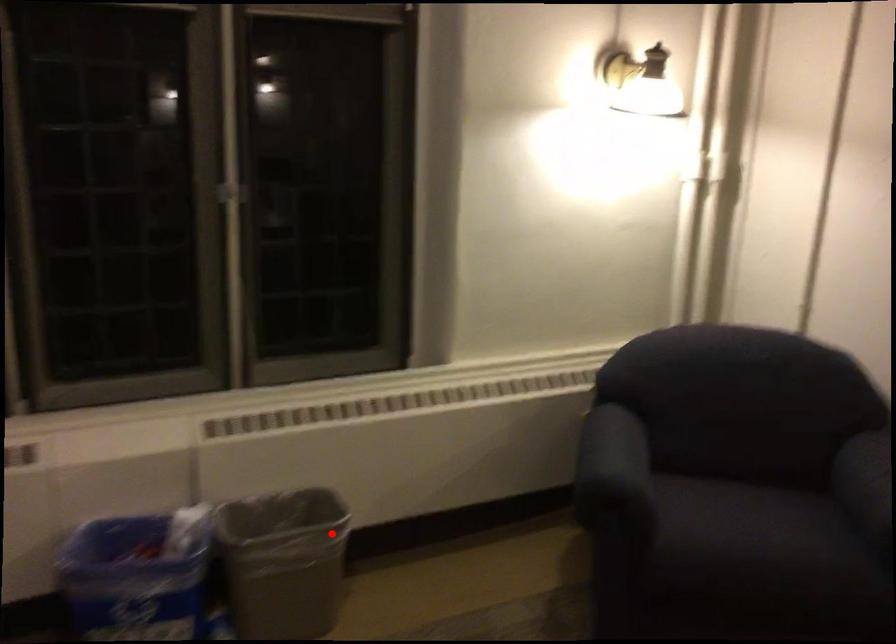
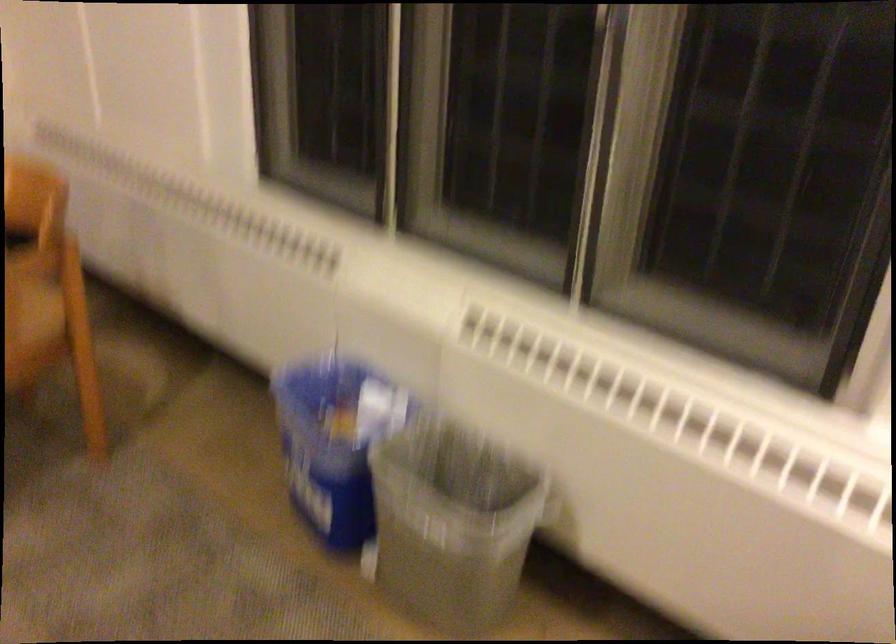
In the second image, find the point that corresponds to the highlighted location in the first image.

(451, 524)